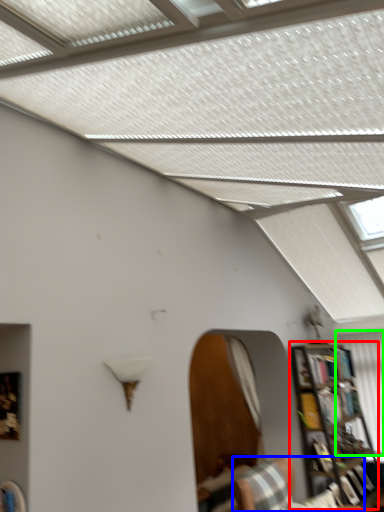
Question: Based on their relative distances, which object is nearer to bookcase (highlighted by a red box)? Choose from furniture (highlighted by a blue box) and curtain (highlighted by a green box).

Choices:
 (A) furniture
 (B) curtain

Answer: (B)